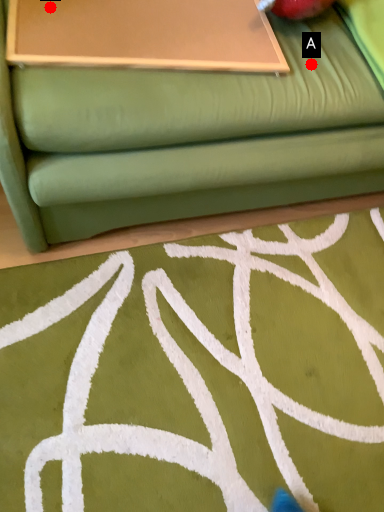
Question: Two points are circled on the image, labeled by A and B beside each circle. Which point appears farthest from the camera in this image?

Choices:
 (A) A is further
 (B) B is further

Answer: (A)